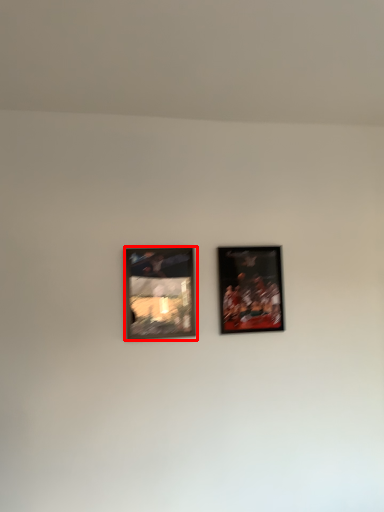
Question: From the image's perspective, where is picture frame (annotated by the red box) located in relation to picture frame in the image?

Choices:
 (A) below
 (B) above

Answer: (A)